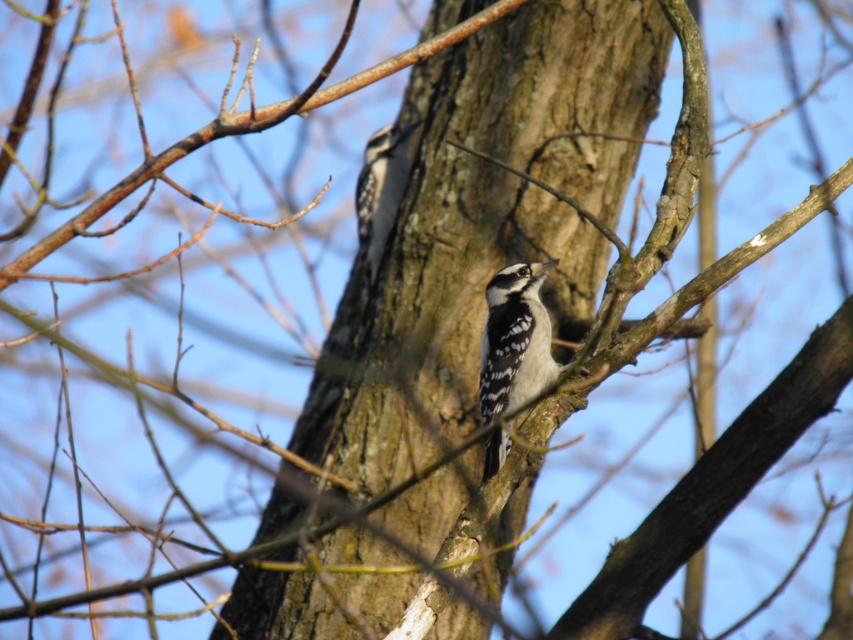
You are a photographer aiming to capture the white speckled woodpecker at center. Based on the coordinates provided, where should you position your camera to ensure the bird is centered in your shot?

The white speckled woodpecker at center is located at coordinates point (x=515, y=340), so you should position your camera to aim directly at that point to center the bird in your shot.

You are a birdwatcher observing the scene. You notice the brown rough bark at center and the white speckled woodpecker at center. Which object is shorter in height?

The brown rough bark at center is shorter in height compared to the white speckled woodpecker at center according to the description.

You are a birdwatcher trying to take a photo of the speckled brown woodpecker at center. You notice the brown rough bark at center in the background. Which object is positioned lower in the image?

The brown rough bark at center is located below the speckled brown woodpecker at center, so the brown rough bark at center is positioned lower in the image.